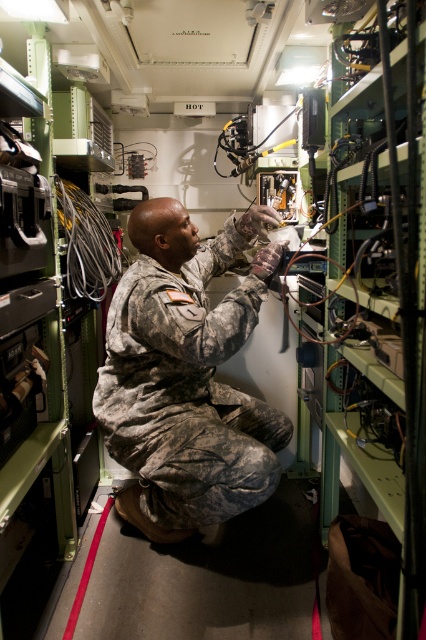
You are a technician entering the equipment room and need to identify the objects in front of you. Which object is taller between the camouflage fabric uniform at center and the black rubber wire at center?

The camouflage fabric uniform at center is taller than the black rubber wire at center according to the description.

You are a technician entering the equipment room and need to access the black rubber wire at center. Is the camouflage fabric uniform at center blocking your path to it?

The camouflage fabric uniform at center is in front of the black rubber wire at center, so yes, the uniform is blocking the path to the wire.